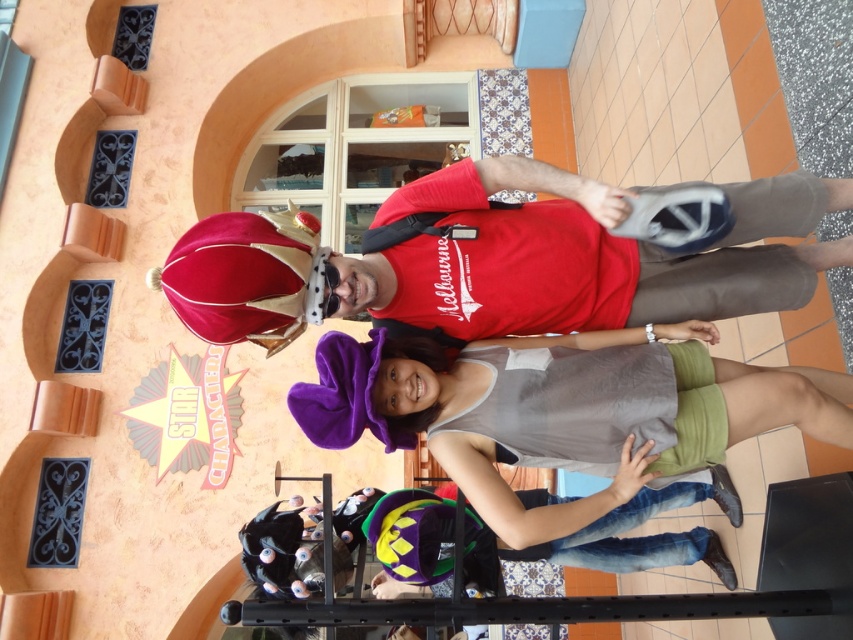
Does velvet crown at upper center have a greater width compared to gray fabric tank top at center?

Yes, velvet crown at upper center is wider than gray fabric tank top at center.

Is velvet crown at upper center positioned before gray fabric tank top at center?

Yes, it is.

Describe the element at coordinates (577, 260) in the screenshot. I see `velvet crown at upper center` at that location.

Locate an element on the screen. velvet crown at upper center is located at coordinates (577, 260).